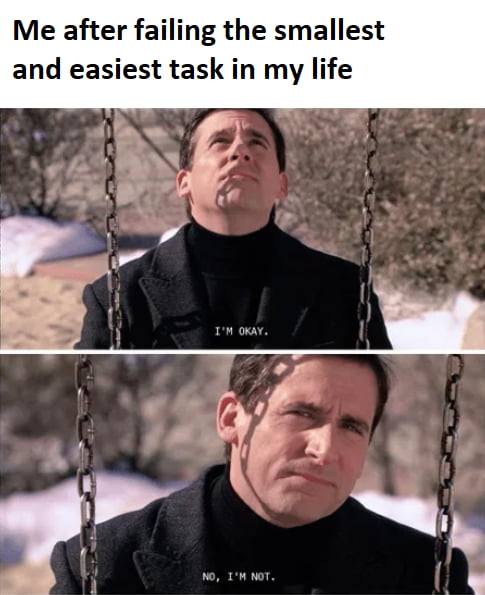
Find the location of `top panel`. top panel is located at coordinates (153, 198).